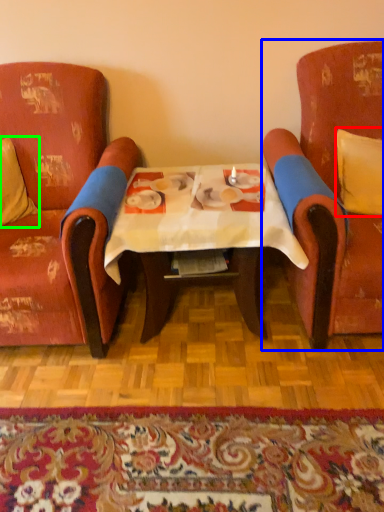
Question: Which is farther away from pillow (highlighted by a red box)? chair (highlighted by a blue box) or pillow (highlighted by a green box)?

Choices:
 (A) chair
 (B) pillow

Answer: (B)